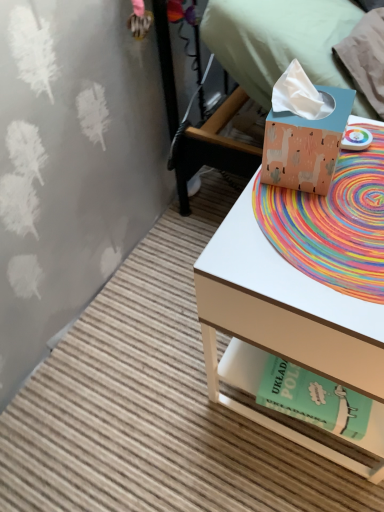
Question: Is rainbow woven mat at center taller than matte peach tissue box at upper right?

Choices:
 (A) yes
 (B) no

Answer: (B)

Question: Is rainbow woven mat at center positioned behind matte peach tissue box at upper right?

Choices:
 (A) no
 (B) yes

Answer: (A)

Question: Does rainbow woven mat at center lie in front of matte peach tissue box at upper right?

Choices:
 (A) no
 (B) yes

Answer: (B)

Question: Can you confirm if rainbow woven mat at center is bigger than matte peach tissue box at upper right?

Choices:
 (A) no
 (B) yes

Answer: (A)

Question: Can you confirm if rainbow woven mat at center is shorter than matte peach tissue box at upper right?

Choices:
 (A) yes
 (B) no

Answer: (A)

Question: Are rainbow woven mat at center and matte peach tissue box at upper right located far from each other?

Choices:
 (A) no
 (B) yes

Answer: (A)

Question: Is matte cardboard tissue box at right taller than matte peach tissue box at upper right?

Choices:
 (A) yes
 (B) no

Answer: (A)

Question: From a real-world perspective, does matte cardboard tissue box at right stand above matte peach tissue box at upper right?

Choices:
 (A) no
 (B) yes

Answer: (A)

Question: Are matte cardboard tissue box at right and matte peach tissue box at upper right far apart?

Choices:
 (A) no
 (B) yes

Answer: (A)

Question: Can you confirm if matte cardboard tissue box at right is thinner than matte peach tissue box at upper right?

Choices:
 (A) no
 (B) yes

Answer: (A)

Question: Would you say matte cardboard tissue box at right contains matte peach tissue box at upper right?

Choices:
 (A) no
 (B) yes

Answer: (A)

Question: Is matte cardboard tissue box at right in contact with matte peach tissue box at upper right?

Choices:
 (A) yes
 (B) no

Answer: (B)

Question: Is green paper at lower right facing towards matte cardboard tissue box at right?

Choices:
 (A) yes
 (B) no

Answer: (A)